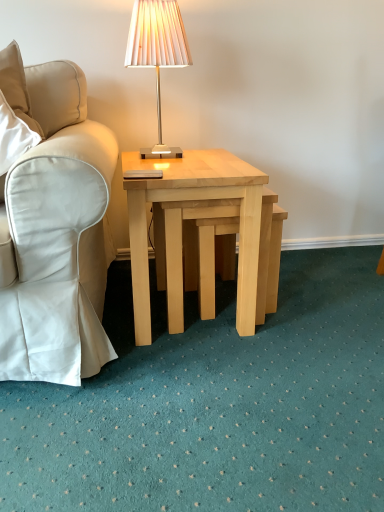
Question: Should I look upward or downward to see light wood/natural wood coffee table at center?

Choices:
 (A) down
 (B) up

Answer: (B)

Question: Considering the relative positions of light wood/natural wood coffee table at center and matte beige lamp at upper center in the image provided, is light wood/natural wood coffee table at center to the right of matte beige lamp at upper center from the viewer's perspective?

Choices:
 (A) no
 (B) yes

Answer: (B)

Question: Does light wood/natural wood coffee table at center turn towards matte beige lamp at upper center?

Choices:
 (A) no
 (B) yes

Answer: (A)

Question: Is light wood/natural wood coffee table at center thinner than matte beige lamp at upper center?

Choices:
 (A) yes
 (B) no

Answer: (B)

Question: Considering the relative sizes of light wood/natural wood coffee table at center and matte beige lamp at upper center in the image provided, is light wood/natural wood coffee table at center smaller than matte beige lamp at upper center?

Choices:
 (A) yes
 (B) no

Answer: (B)

Question: Is light wood/natural wood coffee table at center beside matte beige lamp at upper center?

Choices:
 (A) no
 (B) yes

Answer: (A)

Question: From the image's perspective, is light wood/natural wood coffee table at center over matte beige lamp at upper center?

Choices:
 (A) yes
 (B) no

Answer: (B)

Question: Does light wood/natural wood coffee table at center lie in front of white fabric chair at left?

Choices:
 (A) yes
 (B) no

Answer: (B)

Question: Are light wood/natural wood coffee table at center and white fabric chair at left far apart?

Choices:
 (A) no
 (B) yes

Answer: (A)

Question: From a real-world perspective, does light wood/natural wood coffee table at center stand above white fabric chair at left?

Choices:
 (A) no
 (B) yes

Answer: (A)

Question: Can you confirm if light wood/natural wood coffee table at center is bigger than white fabric chair at left?

Choices:
 (A) no
 (B) yes

Answer: (B)

Question: Could you tell me if light wood/natural wood coffee table at center is facing white fabric chair at left?

Choices:
 (A) yes
 (B) no

Answer: (B)

Question: Considering the relative positions of light wood/natural wood coffee table at center and white fabric chair at left in the image provided, is light wood/natural wood coffee table at center to the right of white fabric chair at left from the viewer's perspective?

Choices:
 (A) yes
 (B) no

Answer: (A)

Question: Is light wood/natural wood coffee table at center completely or partially inside white fabric chair at left?

Choices:
 (A) no
 (B) yes

Answer: (A)